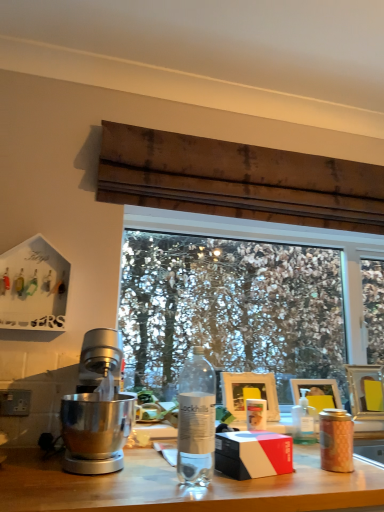
Question: Considering the positions of transparent glass window at center and clear glass bottle at center, the 2th bottle from the bottom, in the image, is transparent glass window at center wider or thinner than clear glass bottle at center, the 2th bottle from the bottom,?

Choices:
 (A) wide
 (B) thin

Answer: (B)

Question: Would you say transparent glass window at center is inside or outside clear glass bottle at center, which ranks as the second bottle in back-to-front order?

Choices:
 (A) inside
 (B) outside

Answer: (B)

Question: Which object is the farthest from the transparent glass window at center?

Choices:
 (A) matte gold canister at right, which appears as the second coffee cup when viewed from the back
 (B) satin silver power outlet at lower left
 (C) white matte picture frame at center, which is the 1th picture frame in left-to-right order
 (D) pink matte coffee cup at center, the 2th coffee cup from the right
 (E) clear plastic bottle at center, the second bottle from the top

Answer: (A)

Question: Estimate the real-world distances between objects in this image. Which object is closer to the clear plastic bottle at center, the 1th bottle in the back-to-front sequence?

Choices:
 (A) white matte picture frame at center, which is the 1th picture frame in left-to-right order
 (B) matte gold canister at right, which appears as the second coffee cup when viewed from the back
 (C) transparent glass window at center
 (D) matte black box at center
 (E) polished silver mixer at left

Answer: (A)